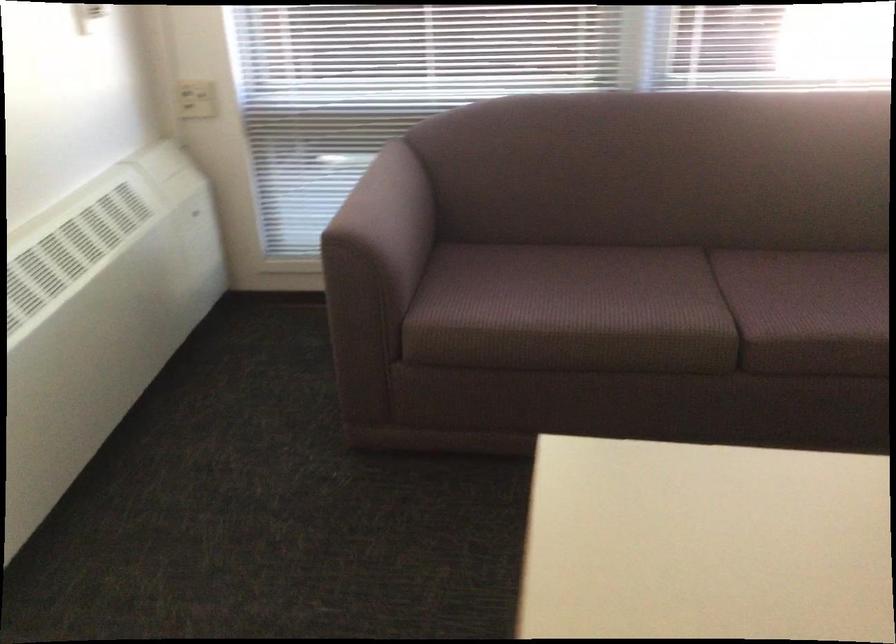
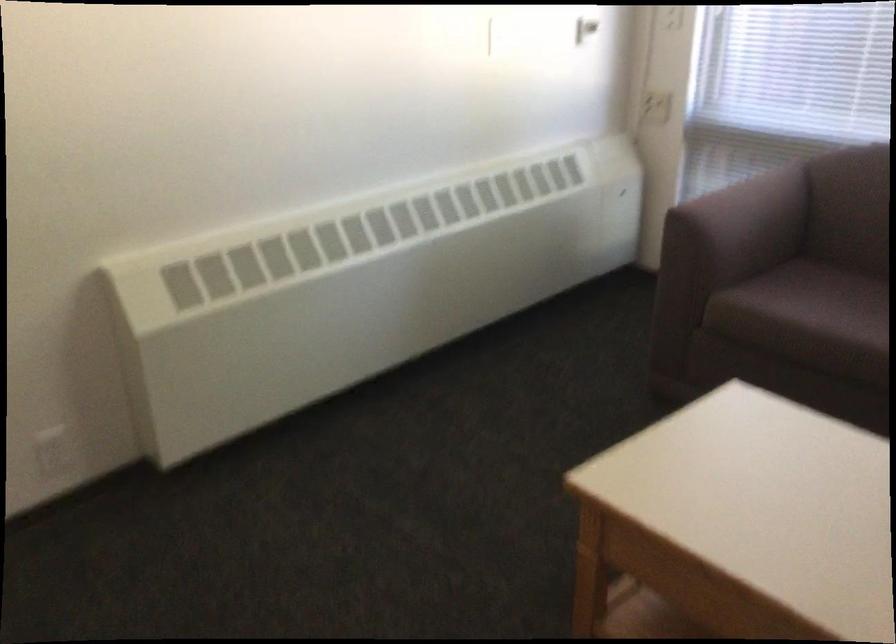
Locate, in the second image, the point that corresponds to point (202, 105) in the first image.

(656, 107)